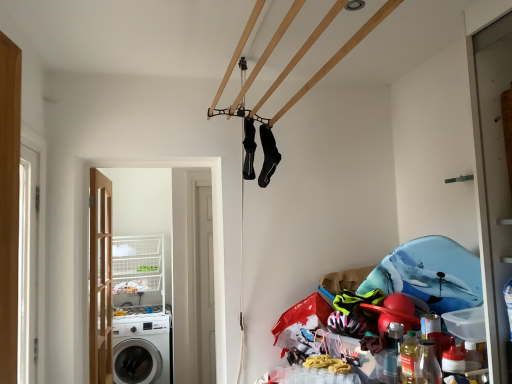
Question: Does point (102, 322) appear closer or farther from the camera than point (260, 135)?

Choices:
 (A) closer
 (B) farther

Answer: (B)

Question: Looking at their shapes, would you say wooden door at left is wider or thinner than black matte socks at upper center, marked as the 1th clothing in a right-to-left arrangement?

Choices:
 (A) wide
 (B) thin

Answer: (A)

Question: Estimate the real-world distances between objects in this image. Which object is farther from the white glossy washing machine at lower left?

Choices:
 (A) white wire basket at lower left
 (B) white plastic laundry basket at left
 (C) black matte socks at upper center, marked as the 1th clothing in a right-to-left arrangement
 (D) black matte socks at center, the 1th clothing viewed from the left
 (E) wooden door at left

Answer: (D)

Question: Based on their relative distances, which object is farther from the white glossy washing machine at lower left?

Choices:
 (A) wooden door at left
 (B) white wire basket at lower left
 (C) white plastic laundry basket at left
 (D) black matte socks at upper center, marked as the 1th clothing in a right-to-left arrangement
 (E) black matte socks at center, the second clothing in the right-to-left sequence

Answer: (E)